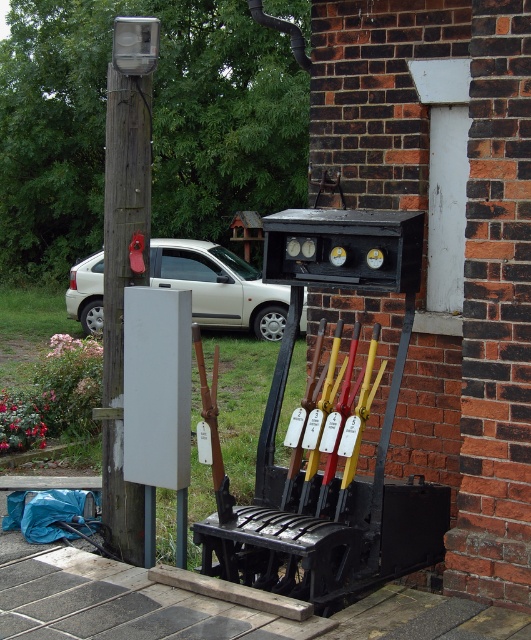
Is wooden pole at left shorter than white matte car at left?

Correct, wooden pole at left is not as tall as white matte car at left.

Can you confirm if wooden pole at left is positioned to the right of white matte car at left?

Indeed, wooden pole at left is positioned on the right side of white matte car at left.

Find the location of a particular element. wooden pole at left is located at coordinates (124, 257).

In order to click on wooden pole at left in this screenshot , I will do `click(124, 257)`.